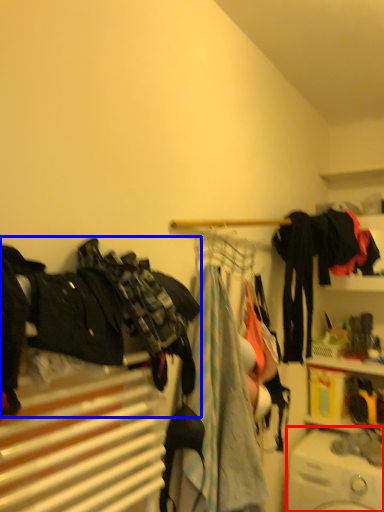
Question: Which object appears closest to the camera in this image, washing machine (highlighted by a red box) or clothing (highlighted by a blue box)?

Choices:
 (A) washing machine
 (B) clothing

Answer: (B)